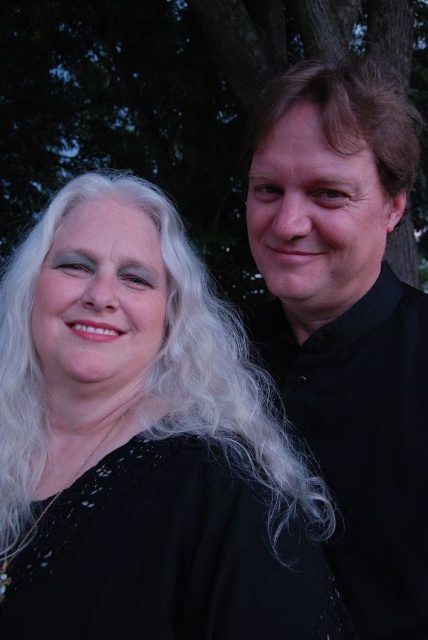
You are taking a photo of two people standing in front of a tree. You notice two points in the image labeled as point (98,637) and point (183,1). Which point is closer to the camera?

Point (98,637) is closer to the camera than point (183,1).

You are a photographer trying to capture a photo of the black smooth shirt at right and the black lace dress at center. Which one is closer to the camera?

The black smooth shirt at right is closer to the camera than the black lace dress at center.